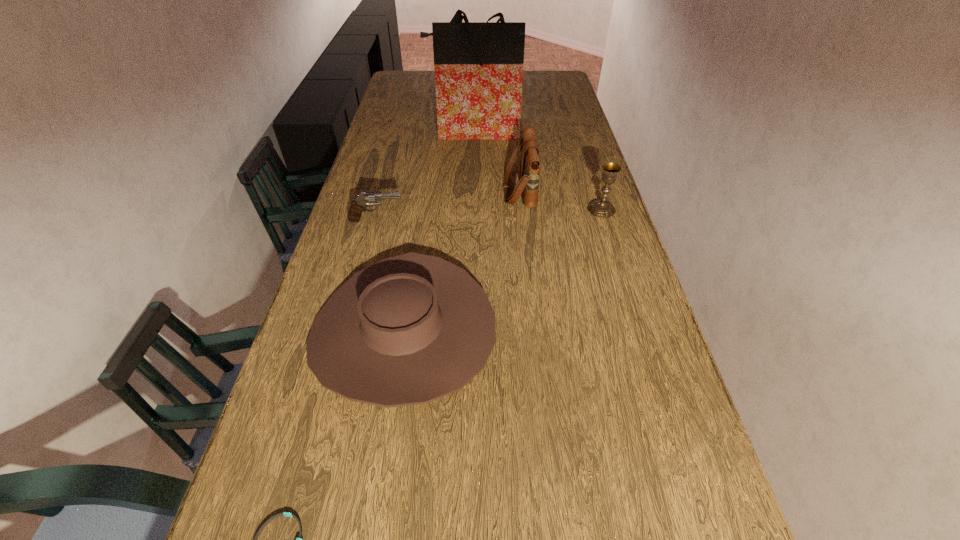
Where is `the tallest object`? Image resolution: width=960 pixels, height=540 pixels. the tallest object is located at coordinates (478, 66).

Where is `the farthest object`? This screenshot has height=540, width=960. the farthest object is located at coordinates (478, 66).

Locate an element on the screen. The image size is (960, 540). shoulder bag is located at coordinates (528, 185).

The image size is (960, 540). I want to click on chalice, so click(600, 208).

Locate an element on the screen. The height and width of the screenshot is (540, 960). the rightmost object is located at coordinates (600, 208).

You are a GUI agent. You are given a task and a screenshot of the screen. Output one action in this format:
    pyautogui.click(x=<x>, y=<y>)
    Task: Click on the second nearest object
    
    Given the screenshot: What is the action you would take?
    pyautogui.click(x=410, y=329)

I want to click on pistol, so click(366, 198).

I want to click on free space located 0.230m on the front side of the farthest object, so click(472, 174).

I want to click on free space located 0.210m on the front-facing side of the shoulder bag, so click(x=441, y=190).

This screenshot has width=960, height=540. Find the location of `free space located on the front-facing side of the shoulder bag`. free space located on the front-facing side of the shoulder bag is located at coordinates (473, 190).